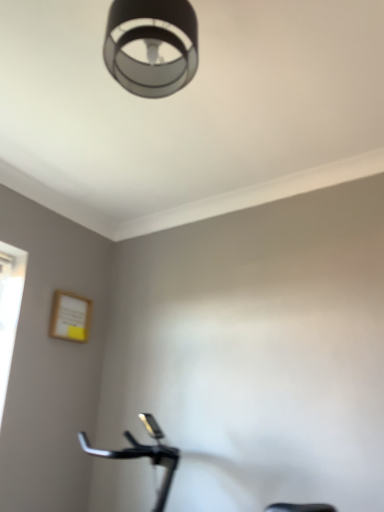
Question: Would you say matte black lampshade at upper center is inside or outside black matte stationary bicycle at lower center?

Choices:
 (A) outside
 (B) inside

Answer: (A)

Question: Is matte black lampshade at upper center taller or shorter than black matte stationary bicycle at lower center?

Choices:
 (A) tall
 (B) short

Answer: (B)

Question: In the image, is matte black lampshade at upper center positioned in front of or behind black matte stationary bicycle at lower center?

Choices:
 (A) behind
 (B) front

Answer: (B)

Question: Considering the positions of black matte stationary bicycle at lower center and matte black lampshade at upper center in the image, is black matte stationary bicycle at lower center taller or shorter than matte black lampshade at upper center?

Choices:
 (A) tall
 (B) short

Answer: (A)

Question: Is black matte stationary bicycle at lower center in front of or behind matte black lampshade at upper center in the image?

Choices:
 (A) behind
 (B) front

Answer: (A)

Question: In terms of width, does black matte stationary bicycle at lower center look wider or thinner when compared to matte black lampshade at upper center?

Choices:
 (A) wide
 (B) thin

Answer: (A)

Question: Would you say black matte stationary bicycle at lower center is inside or outside matte black lampshade at upper center?

Choices:
 (A) outside
 (B) inside

Answer: (A)